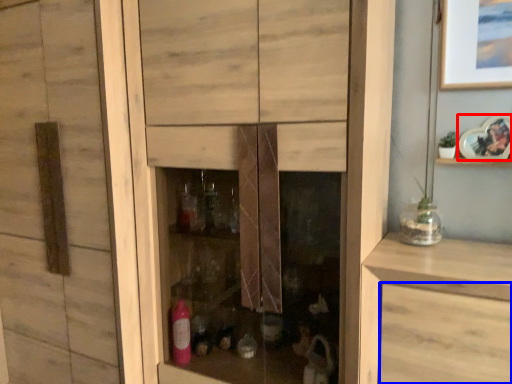
Question: Which point is further to the camera, picture frame (highlighted by a red box) or drawer (highlighted by a blue box)?

Choices:
 (A) picture frame
 (B) drawer

Answer: (A)